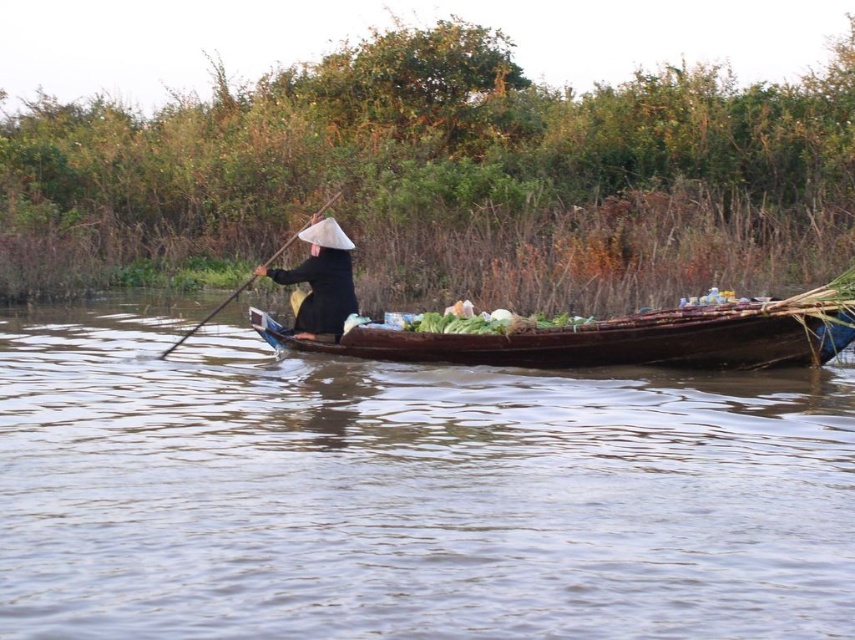
You are a photographer trying to capture the boat and its surroundings. You notice two points in the scene at coordinates point (97,320) and point (233,292). Which point is closer to your camera lens?

Point (97,320) is closer to the camera than point (233,292).

You are a delivery person who needs to move a package from the brown wooden boat at center to the wooden smooth paddle at center. What is the minimum distance you need to travel?

The minimum distance you need to travel is 5.12 meters between the brown wooden boat at center and the wooden smooth paddle at center.